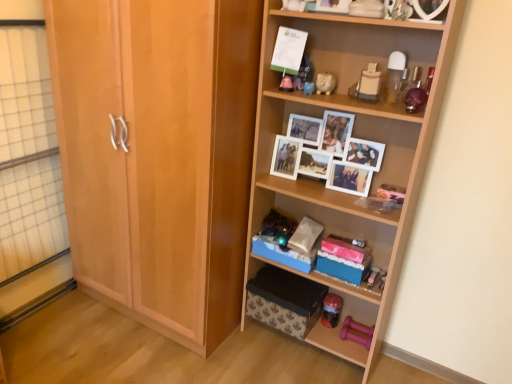
Locate an element on the screen. This screenshot has width=512, height=384. free space that is in between light brown wood cabinet at left and transparent glass door at left is located at coordinates (90, 337).